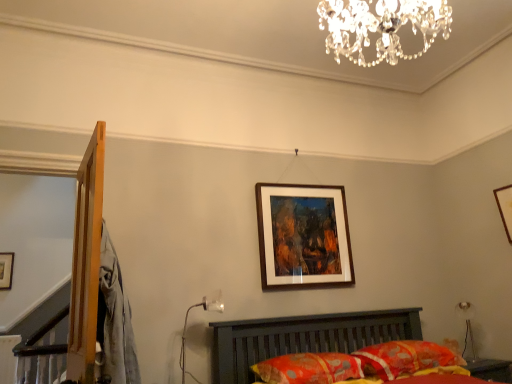
Question: Considering the positions of metallic glass table lamp at lower center, marked as the 1th table lamp in a front-to-back arrangement, and floral fabric pillow at lower center, arranged as the second pillow when viewed from the left, in the image, is metallic glass table lamp at lower center, marked as the 1th table lamp in a front-to-back arrangement, wider or thinner than floral fabric pillow at lower center, arranged as the second pillow when viewed from the left,?

Choices:
 (A) thin
 (B) wide

Answer: (A)

Question: Is metallic glass table lamp at lower center, marked as the 1th table lamp in a front-to-back arrangement, taller or shorter than floral fabric pillow at lower center, arranged as the first pillow when viewed from the right?

Choices:
 (A) tall
 (B) short

Answer: (A)

Question: Which is farther from the metallic glass table lamp at lower center, the first table lamp in the left-to-right sequence?

Choices:
 (A) wooden-framed painting at center, which ranks as the second picture frame in right-to-left order
 (B) wooden picture frame at upper center, the 3th picture frame in the front-to-back sequence
 (C) floral fabric pillow at lower center, arranged as the first pillow when viewed from the right
 (D) metallic silver table lamp at lower right, arranged as the second table lamp when viewed from the left
 (E) wooden picture frame at upper right, acting as the 1th picture frame starting from the right

Answer: (B)

Question: Estimate the real-world distances between objects in this image. Which object is closer to the wooden picture frame at upper right, the 2th picture frame viewed from the back?

Choices:
 (A) floral fabric pillow at lower center, which is the 1th pillow from left to right
 (B) metallic glass table lamp at lower center, marked as the 1th table lamp in a front-to-back arrangement
 (C) floral fabric pillow at lower center, arranged as the first pillow when viewed from the right
 (D) wooden-framed painting at center, positioned as the 1th picture frame in front-to-back order
 (E) wooden picture frame at upper center, the 1th picture frame positioned from the left

Answer: (C)